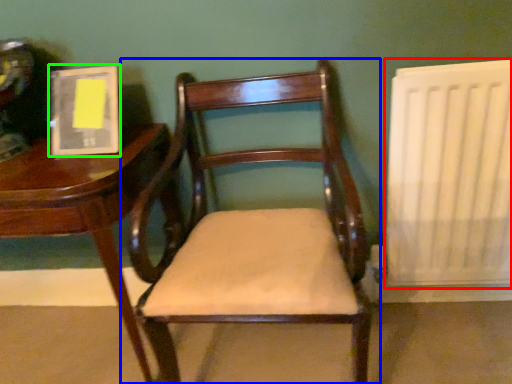
Question: Estimate the real-world distances between objects in this image. Which object is farther from radiator (highlighted by a red box), chair (highlighted by a blue box) or book (highlighted by a green box)?

Choices:
 (A) chair
 (B) book

Answer: (B)